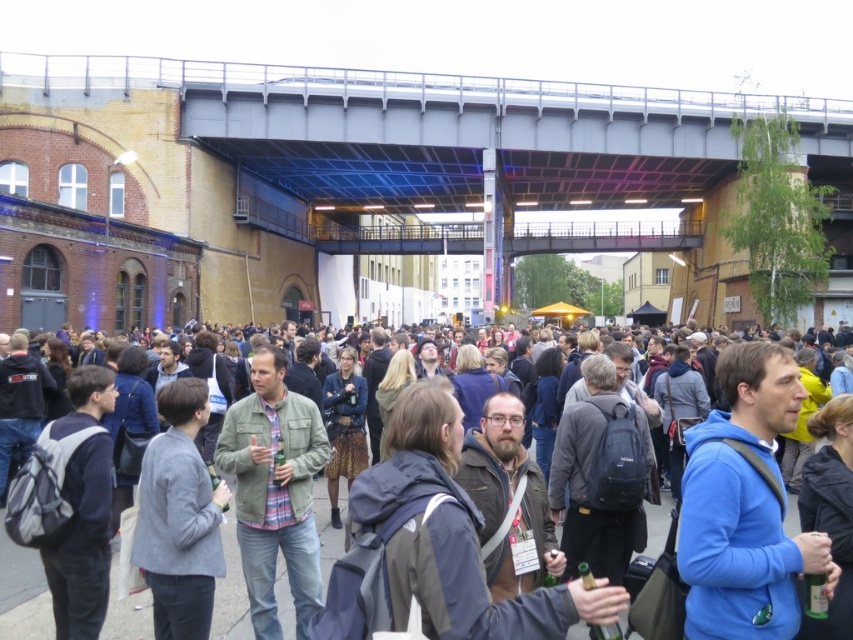
From the picture: You are a photographer trying to capture a candid shot of two people in the crowd. You notice the green matte jacket at center and the dark gray casual clothing at center. Which of the two would be easier to spot from a distance due to their clothing width?

The green matte jacket at center has a lesser width compared to dark gray casual clothing at center, so the dark gray casual clothing at center would be easier to spot from a distance because it is wider.

You are standing at the point marked by the coordinate point (442, 131) in the image. What object are you directly under?

You are directly under the metallic gray bridge at center, as the point (442, 131) represents its location.

You are a photographer at the event and want to capture a photo of the green matte jacket at center without the dark gray casual clothing at center appearing in the foreground. Is this possible based on their positions?

The green matte jacket at center is positioned over the dark gray casual clothing at center, so the dark gray casual clothing at center is behind the green matte jacket at center. Therefore, the photographer can take a photo of the green matte jacket at center without the dark gray casual clothing at center in the foreground because the dark gray casual clothing at center is behind it.